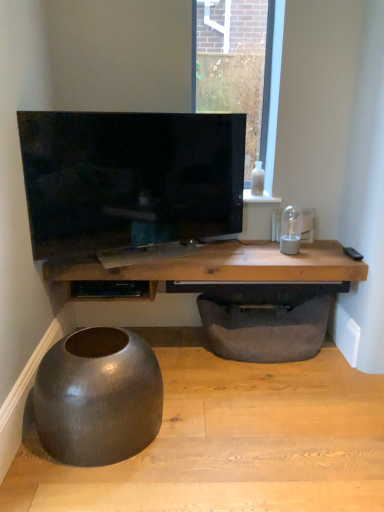
Question: Is matte black bowl at lower left in front of wooden table at center?

Choices:
 (A) yes
 (B) no

Answer: (A)

Question: Can you confirm if matte black bowl at lower left is bigger than wooden table at center?

Choices:
 (A) no
 (B) yes

Answer: (A)

Question: Can you confirm if matte black bowl at lower left is taller than wooden table at center?

Choices:
 (A) yes
 (B) no

Answer: (A)

Question: From a real-world perspective, is matte black bowl at lower left located beneath wooden table at center?

Choices:
 (A) yes
 (B) no

Answer: (A)

Question: Is matte black bowl at lower left further to the viewer compared to wooden table at center?

Choices:
 (A) no
 (B) yes

Answer: (A)

Question: Could wooden table at center be considered to be inside matte black bowl at lower left?

Choices:
 (A) yes
 (B) no

Answer: (B)

Question: Could you tell me if matte gray concrete at lower left is facing dark gray fabric footrest at lower center?

Choices:
 (A) no
 (B) yes

Answer: (A)

Question: From the image's perspective, is matte gray concrete at lower left on dark gray fabric footrest at lower center?

Choices:
 (A) no
 (B) yes

Answer: (A)

Question: Would you say matte gray concrete at lower left is a long distance from dark gray fabric footrest at lower center?

Choices:
 (A) yes
 (B) no

Answer: (B)

Question: Does matte gray concrete at lower left come in front of dark gray fabric footrest at lower center?

Choices:
 (A) no
 (B) yes

Answer: (B)

Question: Does matte gray concrete at lower left have a smaller size compared to dark gray fabric footrest at lower center?

Choices:
 (A) no
 (B) yes

Answer: (A)

Question: From a real-world perspective, is matte gray concrete at lower left located higher than dark gray fabric footrest at lower center?

Choices:
 (A) no
 (B) yes

Answer: (A)

Question: Does white glossy bottle at upper right turn towards wooden table at center?

Choices:
 (A) no
 (B) yes

Answer: (A)